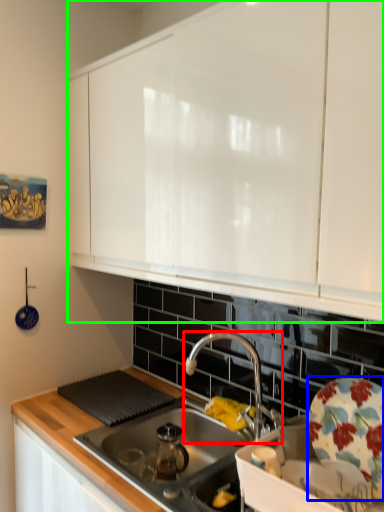
Question: Which is nearer to the tap (highlighted by a red box)? plate (highlighted by a blue box) or cabinetry (highlighted by a green box).

Choices:
 (A) plate
 (B) cabinetry

Answer: (A)